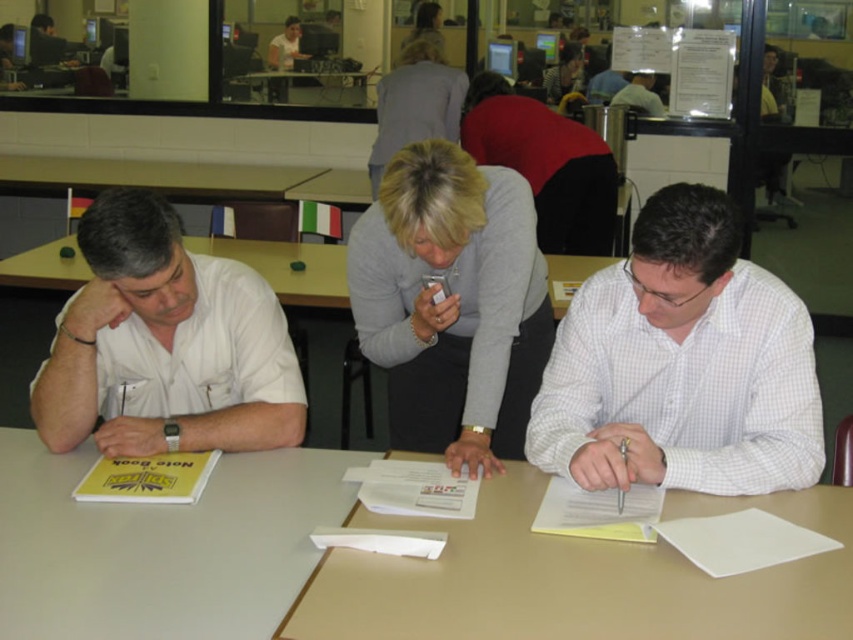
Question: Where is red fabric shirt at center located in relation to gray fabric jacket at upper center in the image?

Choices:
 (A) left
 (B) right

Answer: (B)

Question: Which of the following is the closest to the observer?

Choices:
 (A) (450, 140)
 (B) (592, 154)
 (C) (288, 515)
 (D) (354, 81)

Answer: (C)

Question: Can you confirm if gray fabric jacket at upper center is positioned above smooth gray shirt at center?

Choices:
 (A) yes
 (B) no

Answer: (B)

Question: Estimate the real-world distances between objects in this image. Which object is farther from the beige wood table at center?

Choices:
 (A) clear plastic table at center
 (B) white checkered shirt at right
 (C) white matte shirt at left
 (D) smooth gray shirt at center

Answer: (A)

Question: Can you confirm if red fabric shirt at center is positioned to the right of gray fabric jacket at upper center?

Choices:
 (A) no
 (B) yes

Answer: (B)

Question: Which point is closer to the camera?

Choices:
 (A) white checkered shirt at right
 (B) white matte shirt at left

Answer: (A)